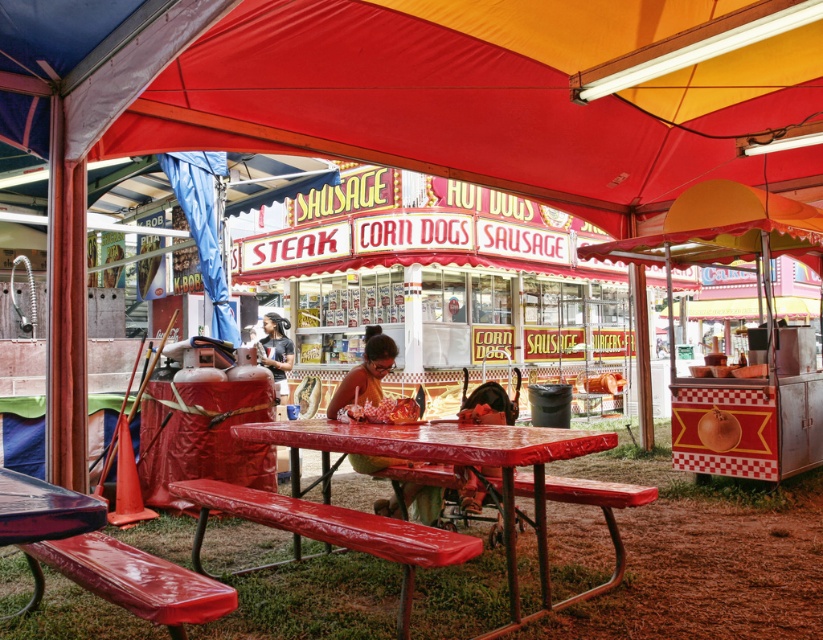
You are a customer at the food stand and want to grab both the matte plastic food truck at center and the matte plastic bag at center. Which one should you pick up first if you want to get the one that is underneath first?

The matte plastic bag at center is underneath the matte plastic food truck at center, so you should pick up the matte plastic bag at center first.